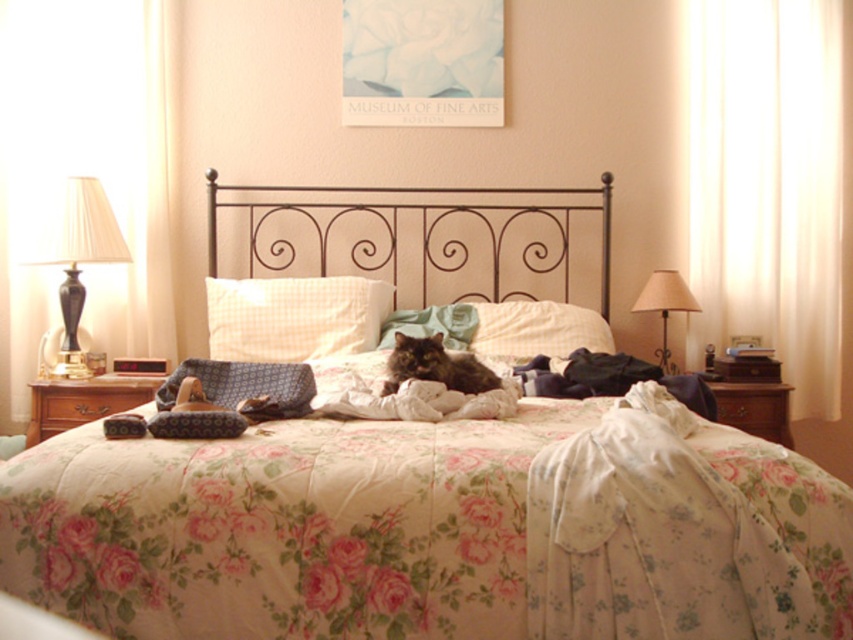
You are organizing the bedroom and need to move the brown wood dresser at lower left. Since the floral cotton blanket at center is currently in front of it, will you have to move the blanket first to access the dresser?

Yes, you will need to move the floral cotton blanket at center first because it is in front of the brown wood dresser at lower left, blocking access to it.